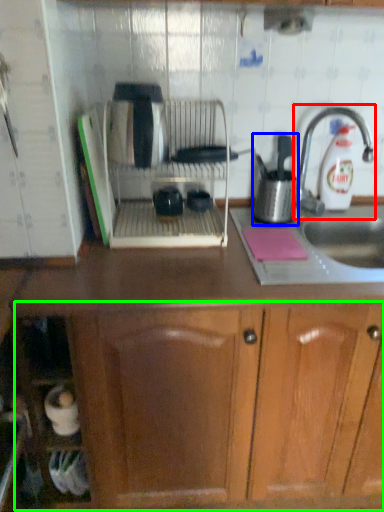
Question: Which object is the closest to the tap (highlighted by a red box)? Choose among these: kitchen appliance (highlighted by a blue box) or drawer (highlighted by a green box).

Choices:
 (A) kitchen appliance
 (B) drawer

Answer: (A)